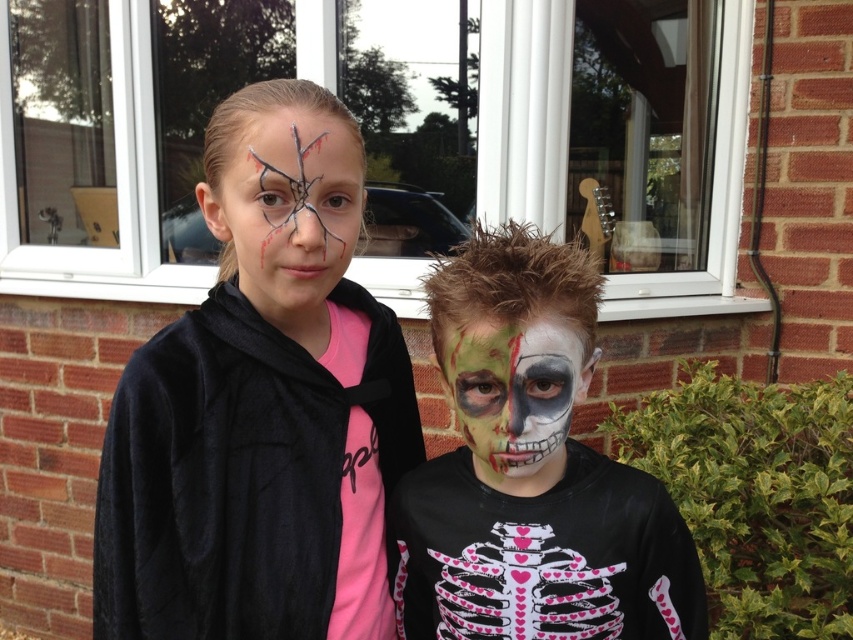
Question: Which point is farther to the camera?

Choices:
 (A) pink matte skeleton shirt at center
 (B) matte black jacket at left
 (C) matte skeleton shirt at center

Answer: (A)

Question: Is matte skeleton shirt at center positioned at the back of pink matte skeleton shirt at center?

Choices:
 (A) yes
 (B) no

Answer: (B)

Question: Which object is closer to the camera taking this photo?

Choices:
 (A) matte black face paint at upper center
 (B) green matte face paint at center
 (C) matte black jacket at left

Answer: (B)

Question: Is pink matte skeleton shirt at center bigger than matte black face paint at upper center?

Choices:
 (A) no
 (B) yes

Answer: (B)

Question: Which point is farther to the camera?

Choices:
 (A) (531, 406)
 (B) (621, 467)

Answer: (B)

Question: Is the position of matte black jacket at left less distant than that of pink matte skeleton shirt at center?

Choices:
 (A) no
 (B) yes

Answer: (B)